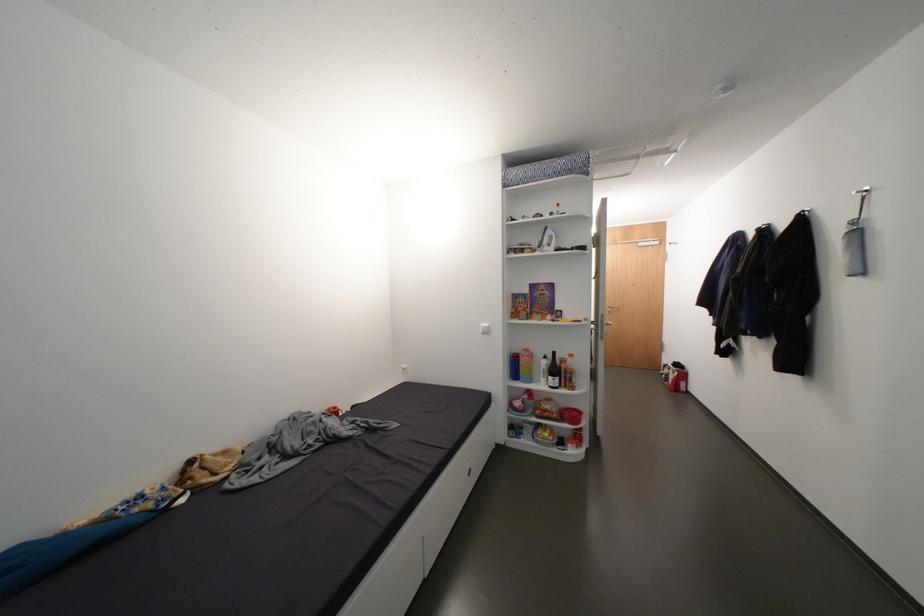
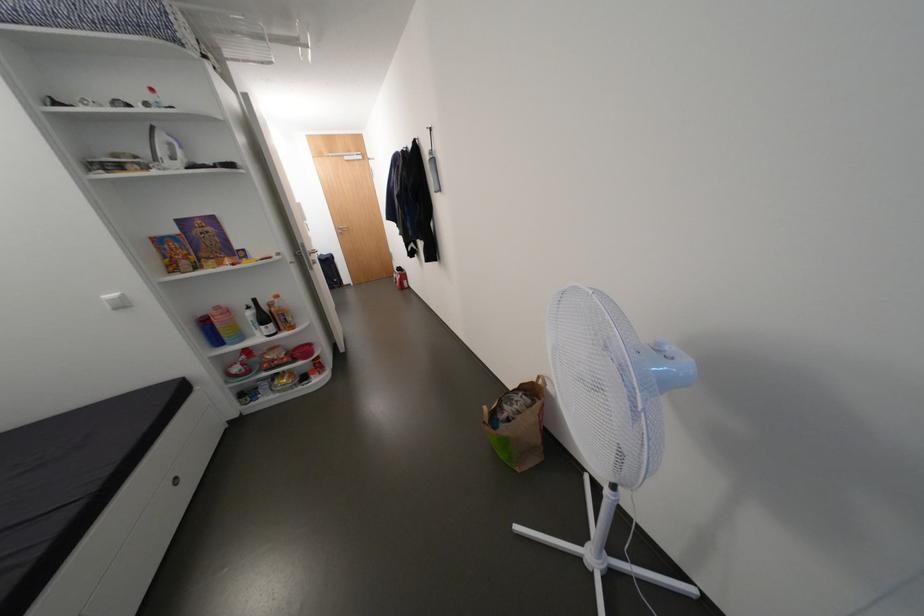
The point at (493, 325) is marked in the first image. Where is the corresponding point in the second image?

(120, 296)